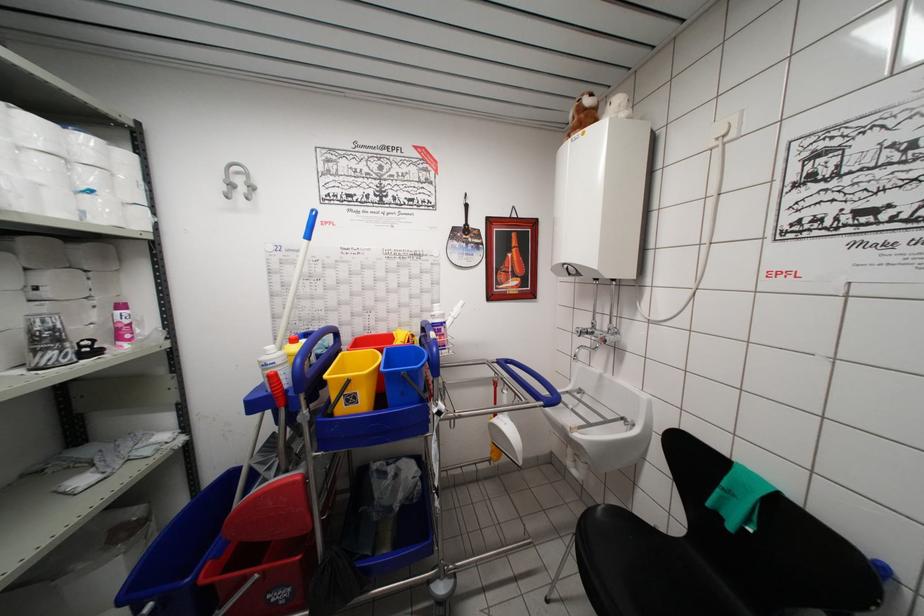
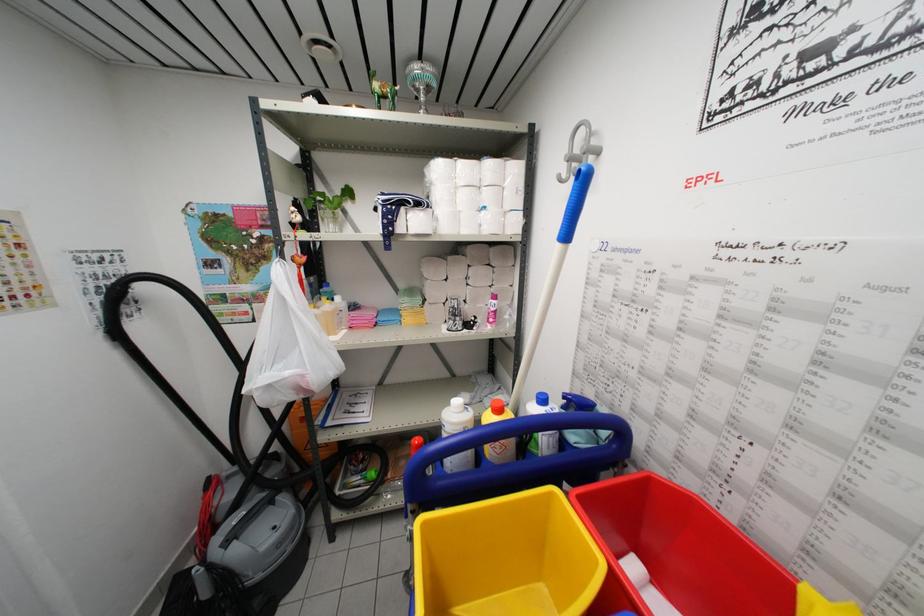
Find the pixel in the second image that matches the point at 71,355 in the first image.

(459, 326)